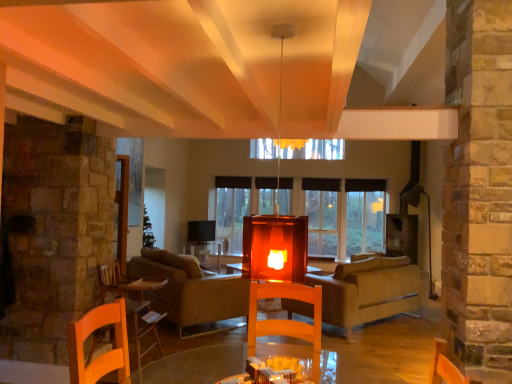
Question: Is the depth of wooden table at lower left less than that of beige fabric couch at center?

Choices:
 (A) yes
 (B) no

Answer: (A)

Question: Can you confirm if wooden table at lower left is wider than beige fabric couch at center?

Choices:
 (A) yes
 (B) no

Answer: (B)

Question: From a real-world perspective, is wooden table at lower left positioned under beige fabric couch at center based on gravity?

Choices:
 (A) no
 (B) yes

Answer: (A)

Question: Is wooden table at lower left to the right of beige fabric couch at center from the viewer's perspective?

Choices:
 (A) no
 (B) yes

Answer: (A)

Question: Considering the relative sizes of wooden table at lower left and beige fabric couch at center in the image provided, is wooden table at lower left shorter than beige fabric couch at center?

Choices:
 (A) yes
 (B) no

Answer: (B)

Question: Can we say wooden table at lower left lies outside beige fabric couch at center?

Choices:
 (A) yes
 (B) no

Answer: (A)

Question: Can we say transparent glass window at center lies outside wooden table at lower left?

Choices:
 (A) yes
 (B) no

Answer: (A)

Question: Does transparent glass window at center appear on the right side of wooden table at lower left?

Choices:
 (A) yes
 (B) no

Answer: (A)

Question: Is wooden table at lower left inside transparent glass window at center?

Choices:
 (A) no
 (B) yes

Answer: (A)

Question: Is transparent glass window at center positioned behind wooden table at lower left?

Choices:
 (A) yes
 (B) no

Answer: (A)

Question: Is transparent glass window at center at the left side of wooden table at lower left?

Choices:
 (A) yes
 (B) no

Answer: (B)

Question: From a real-world perspective, is transparent glass window at center physically below wooden table at lower left?

Choices:
 (A) yes
 (B) no

Answer: (B)

Question: Considering the relative sizes of beige fabric couch at center and velvet beige couch at center in the image provided, is beige fabric couch at center wider than velvet beige couch at center?

Choices:
 (A) yes
 (B) no

Answer: (A)